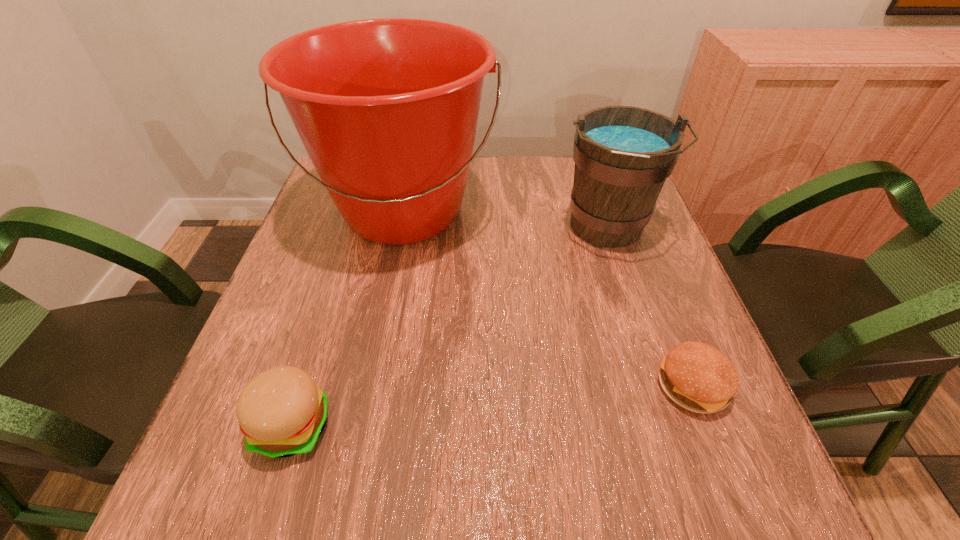
The width and height of the screenshot is (960, 540). Identify the location of bucket located in the far edge section of the desktop. (387, 109).

This screenshot has width=960, height=540. Find the location of `wine bucket at the far edge`. wine bucket at the far edge is located at coordinates (623, 155).

You are a GUI agent. You are given a task and a screenshot of the screen. Output one action in this format:
    pyautogui.click(x=<x>, y=<y>)
    Task: Click on the object that is at the near edge
    The height and width of the screenshot is (540, 960).
    Given the screenshot: What is the action you would take?
    pyautogui.click(x=282, y=412)

I want to click on bucket that is at the left edge, so click(x=387, y=109).

I want to click on hamburger present at the left edge, so click(x=282, y=412).

I want to click on wine bucket at the right edge, so click(x=623, y=155).

This screenshot has width=960, height=540. What are the coordinates of `hamburger that is at the right edge` in the screenshot? It's located at (696, 376).

Locate an element on the screen. Image resolution: width=960 pixels, height=540 pixels. object that is at the far left corner is located at coordinates (387, 109).

Locate an element on the screen. The width and height of the screenshot is (960, 540). object located at the near left corner is located at coordinates (282, 412).

Image resolution: width=960 pixels, height=540 pixels. I want to click on object at the far right corner, so click(623, 155).